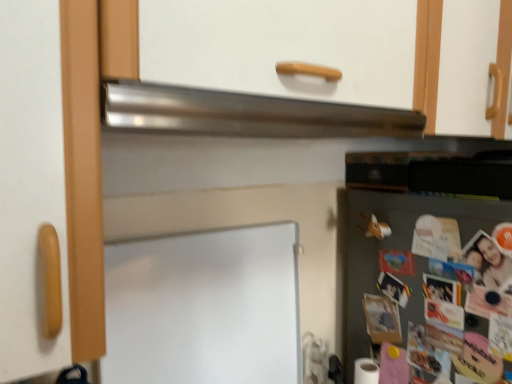
Question: Visually, is white matte board at center positioned to the left or to the right of satin metallic exhaust hood at upper center?

Choices:
 (A) left
 (B) right

Answer: (A)

Question: From the image's perspective, is white matte board at center positioned above or below satin metallic exhaust hood at upper center?

Choices:
 (A) below
 (B) above

Answer: (A)

Question: Estimate the real-world distances between objects in this image. Which object is farther from the white matte board at center?

Choices:
 (A) satin metallic exhaust hood at upper center
 (B) green matte fridge at lower right

Answer: (B)

Question: Estimate the real-world distances between objects in this image. Which object is closer to the satin metallic exhaust hood at upper center?

Choices:
 (A) white matte board at center
 (B) green matte fridge at lower right

Answer: (A)